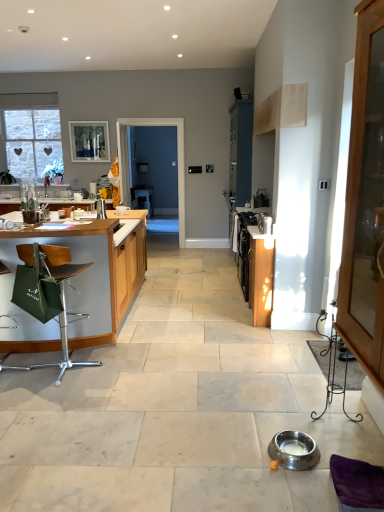
Where is `vacant area that lies between purple fabric swivel chair at lower right and green leather chair at left`? Image resolution: width=384 pixels, height=512 pixels. vacant area that lies between purple fabric swivel chair at lower right and green leather chair at left is located at coordinates (171, 418).